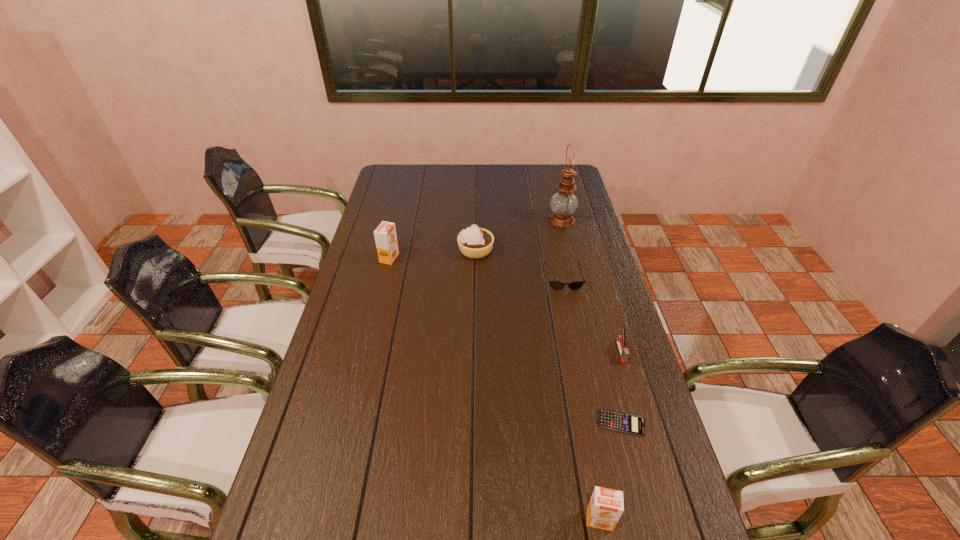
I want to click on the left orange juice, so coord(385,235).

Locate an element on the screen. the sixth shortest object is located at coordinates pos(385,235).

Locate an element on the screen. This screenshot has width=960, height=540. the nearest object is located at coordinates (606, 506).

This screenshot has height=540, width=960. What are the coordinates of `the third tallest object` in the screenshot? It's located at (606, 506).

Find the location of a particular element. the farthest object is located at coordinates (563, 203).

Image resolution: width=960 pixels, height=540 pixels. In order to click on the tallest object in this screenshot , I will do `click(563, 203)`.

What are the coordinates of `sunglasses` in the screenshot? It's located at (556, 285).

At what (x,y) coordinates should I click in order to perform the action: click on the sixth tallest object. Please return your answer as a coordinate pair (x, y). The image size is (960, 540). Looking at the image, I should click on (556, 285).

Where is `whipped cream`? The image size is (960, 540). whipped cream is located at coordinates (473, 242).

Identify the location of the sixth object from right to left. (473, 242).